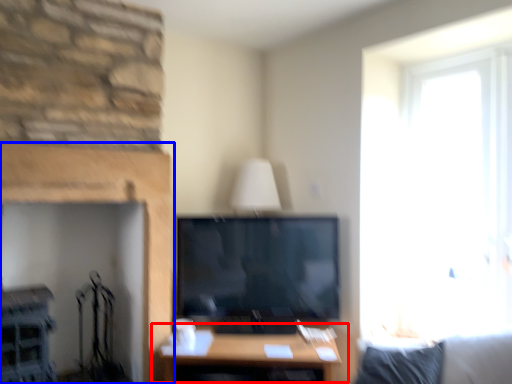
Question: Among these objects, which one is nearest to the camera, table (highlighted by a red box) or fireplace (highlighted by a blue box)?

Choices:
 (A) table
 (B) fireplace

Answer: (B)